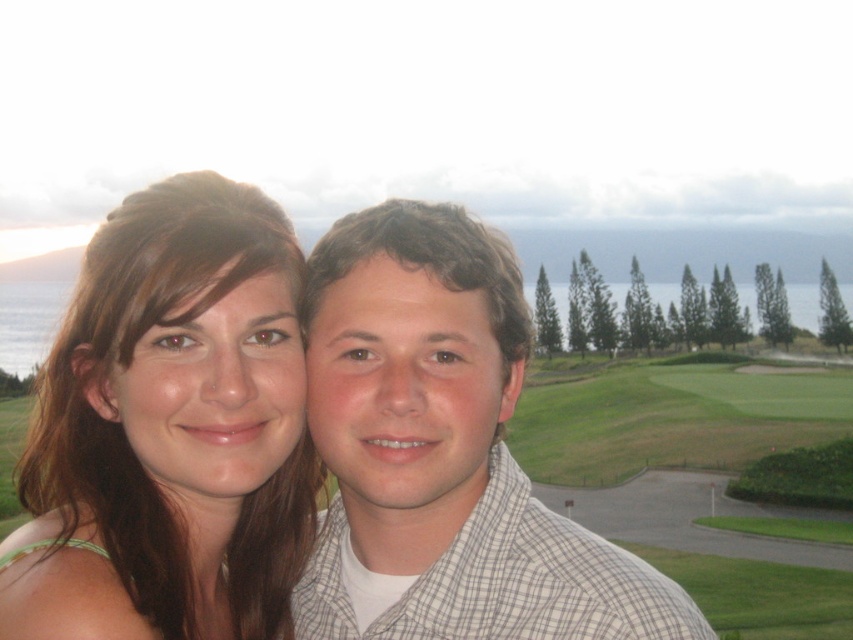
You are a photographer trying to frame a shot of the matte brown hair at center and the matte white shirt at center. Which object should you adjust your camera focus to first if you need to prioritize the wider one?

The matte white shirt at center is wider than the matte brown hair at center, so you should adjust your camera focus to the matte white shirt at center first since it is wider.

You are a photographer trying to adjust the lighting for two subjects in the image. You need to know the relative positions of the matte brown hair at center and the matte white shirt at center to set up the lights properly. Which object is positioned to the left of the other?

The matte brown hair at center is to the left of the matte white shirt at center according to the description.